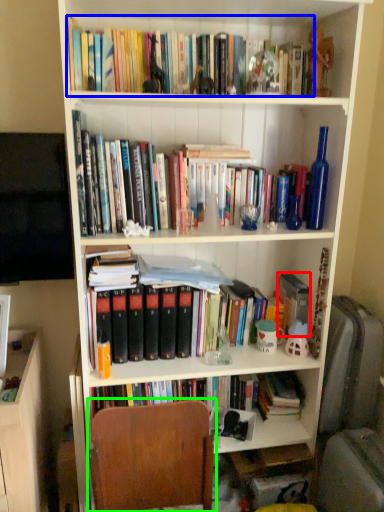
Question: Which object is positioned closest to paperback book (highlighted by a red box)? Select from book (highlighted by a blue box) and chair (highlighted by a green box).

Choices:
 (A) book
 (B) chair

Answer: (B)